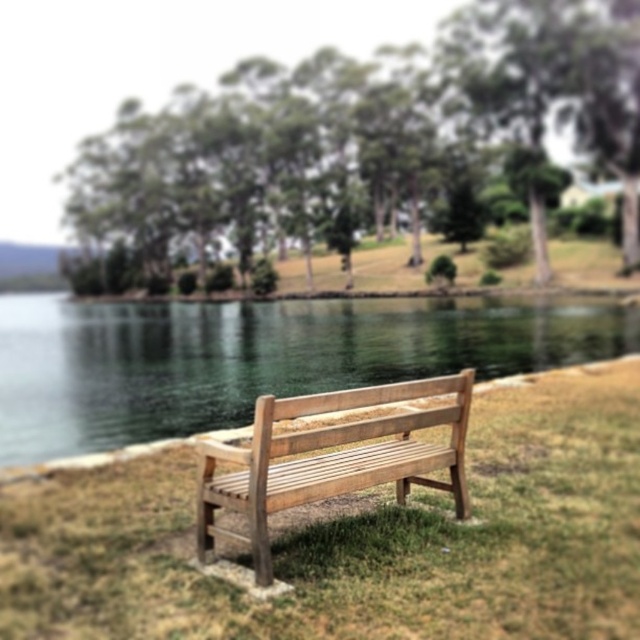
Who is lower down, natural grass bench at center or clear water at bench right?

natural grass bench at center

Which is in front, point (340, 522) or point (536, 371)?

Point (340, 522) is more forward.

Find the location of a particular element. natural grass bench at center is located at coordinates tap(358, 538).

Is point (164, 220) positioned after point (410, 456)?

Yes, point (164, 220) is farther from viewer.

Is the position of green leafy trees at upper center more distant than that of light brown wooden bench at center?

That is True.

Locate an element on the screen. The width and height of the screenshot is (640, 640). green leafy trees at upper center is located at coordinates (360, 141).

You are a GUI agent. You are given a task and a screenshot of the screen. Output one action in this format:
    pyautogui.click(x=<x>, y=<y>)
    Task: Click on the natural grass bench at center
    The width and height of the screenshot is (640, 640).
    Given the screenshot: What is the action you would take?
    pyautogui.click(x=358, y=538)

Where is `natural grass bench at center`? The image size is (640, 640). natural grass bench at center is located at coordinates (358, 538).